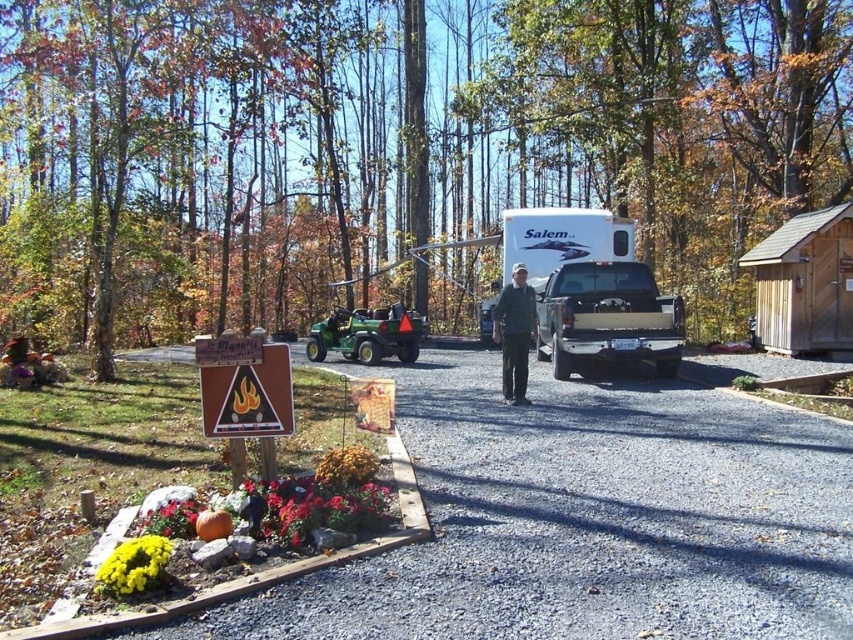
Is brown wood sign at lower left thinner than dark gray jacket at center?

In fact, brown wood sign at lower left might be wider than dark gray jacket at center.

Is brown wood sign at lower left wider than dark gray jacket at center?

Correct, the width of brown wood sign at lower left exceeds that of dark gray jacket at center.

Is point (270, 396) closer to camera compared to point (532, 289)?

Yes, point (270, 396) is closer to viewer.

This screenshot has width=853, height=640. I want to click on brown wood sign at lower left, so click(x=244, y=388).

Is green plastic lawn mower at center taller than dark gray jacket at center?

No.

Image resolution: width=853 pixels, height=640 pixels. What do you see at coordinates (367, 333) in the screenshot?
I see `green plastic lawn mower at center` at bounding box center [367, 333].

Find the location of a particular element. Image resolution: width=853 pixels, height=640 pixels. green plastic lawn mower at center is located at coordinates (367, 333).

Does wooden cabin at right have a greater width compared to brown wood sign at lower left?

Correct, the width of wooden cabin at right exceeds that of brown wood sign at lower left.

This screenshot has height=640, width=853. What do you see at coordinates (804, 284) in the screenshot?
I see `wooden cabin at right` at bounding box center [804, 284].

The width and height of the screenshot is (853, 640). Find the location of `wooden cabin at right`. wooden cabin at right is located at coordinates (804, 284).